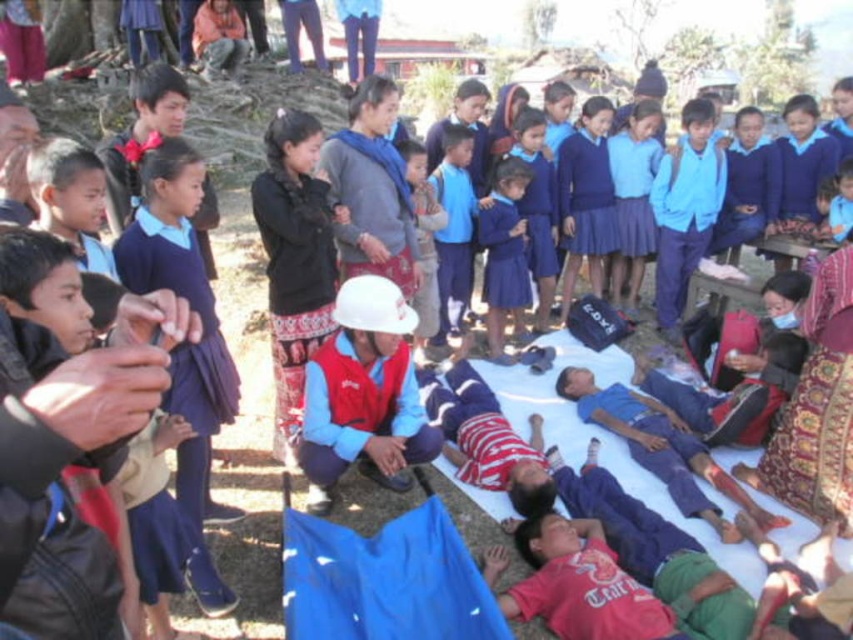
Question: Can you confirm if blue fabric skirt at center is positioned to the left of white matte helmet at center?

Choices:
 (A) no
 (B) yes

Answer: (A)

Question: Can you confirm if blue fabric skirt at center is positioned below white matte helmet at center?

Choices:
 (A) no
 (B) yes

Answer: (B)

Question: Which point is farther from the camera taking this photo?

Choices:
 (A) (485, 221)
 (B) (425, 177)

Answer: (B)

Question: Does blue fabric skirt at center come behind white matte helmet at center?

Choices:
 (A) yes
 (B) no

Answer: (A)

Question: Which point is farther from the camera taking this photo?

Choices:
 (A) (419, 282)
 (B) (514, 204)

Answer: (B)

Question: Which of the following is the closest to the observer?

Choices:
 (A) (519, 196)
 (B) (432, 272)

Answer: (B)